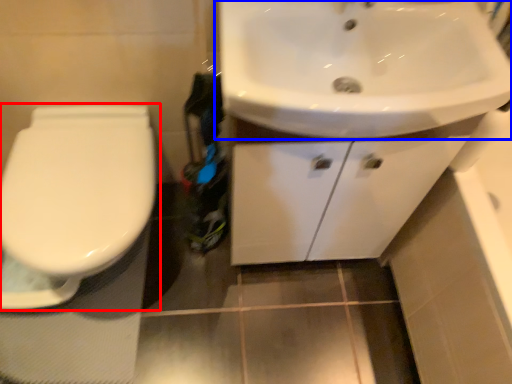
Question: Which point is closer to the camera, toilet (highlighted by a red box) or sink (highlighted by a blue box)?

Choices:
 (A) toilet
 (B) sink

Answer: (B)